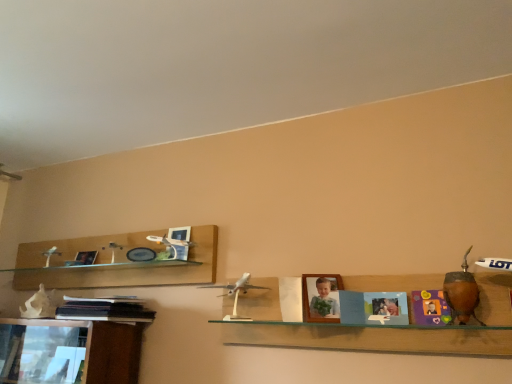
Question: Choose the correct answer: Is wooden photo frame at center, arranged as the first picture frame when viewed from the right, inside silver metallic airplane at center, which ranks as the 2th toy in front-to-back order, or outside it?

Choices:
 (A) outside
 (B) inside

Answer: (A)

Question: Considering the positions of wooden photo frame at center, the 2th picture frame viewed from the back, and silver metallic airplane at center, which ranks as the 2th toy in front-to-back order, in the image, is wooden photo frame at center, the 2th picture frame viewed from the back, bigger or smaller than silver metallic airplane at center, which ranks as the 2th toy in front-to-back order,?

Choices:
 (A) small
 (B) big

Answer: (A)

Question: Which of these objects is positioned farthest from the white plastic airplane at center?

Choices:
 (A) brown wooden vase at right, the second toy when ordered from back to front
 (B) wooden photo frame at center, the 2th picture frame viewed from the back
 (C) silver metallic airplane at center, acting as the second toy starting from the right
 (D) matte plastic picture frame at upper left, which is counted as the first picture frame, starting from the left
 (E) black matte book at lower left

Answer: (D)

Question: Which is nearer to the white plastic airplane at center?

Choices:
 (A) matte plastic picture frame at upper left, positioned as the second picture frame in front-to-back order
 (B) brown wooden vase at right, which is counted as the 2th toy, starting from the left
 (C) wooden photo frame at center, arranged as the first picture frame when viewed from the right
 (D) black matte book at lower left
 (E) silver metallic airplane at center, which is the 1th toy from left to right

Answer: (E)